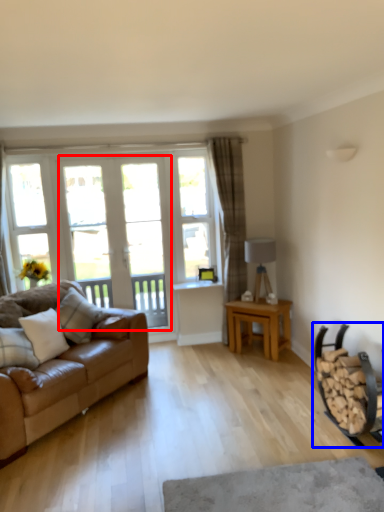
Question: Which of the following is the closest to the observer, screen door (highlighted by a red box) or armchair (highlighted by a blue box)?

Choices:
 (A) screen door
 (B) armchair

Answer: (B)